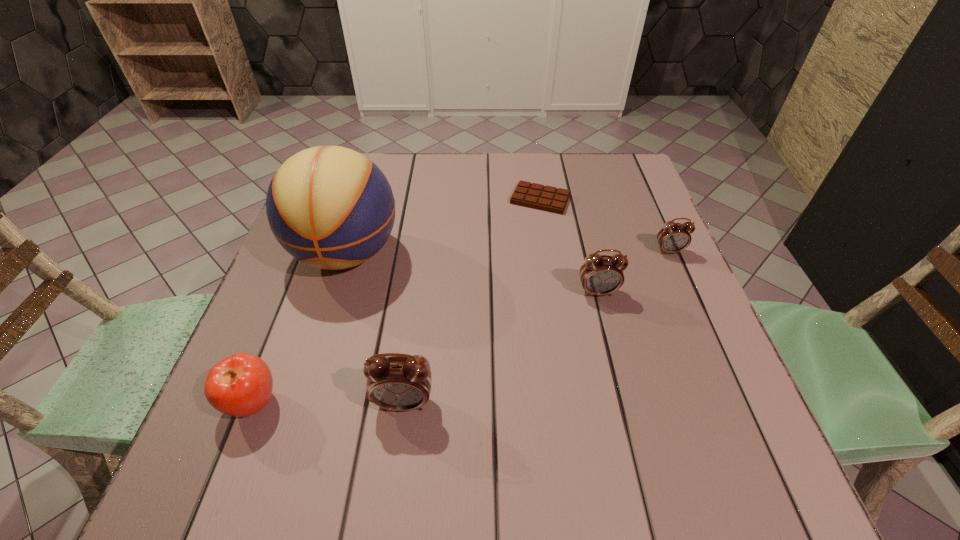
What are the coordinates of `empty location between the second tallest object and the basketball` in the screenshot? It's located at (375, 328).

Where is `unoccupied area between the apple and the rightmost alarm clock`? The height and width of the screenshot is (540, 960). unoccupied area between the apple and the rightmost alarm clock is located at coordinates tap(461, 327).

I want to click on vacant space in between the tallest object and the apple, so click(x=300, y=328).

The width and height of the screenshot is (960, 540). I want to click on free space that is in between the shortest object and the farthest alarm clock, so click(x=605, y=225).

Locate an element on the screen. The image size is (960, 540). free space between the shortest object and the tallest object is located at coordinates (444, 226).

Image resolution: width=960 pixels, height=540 pixels. Identify the location of vacant point located between the second tallest alarm clock and the basketball. (472, 273).

Locate an element on the screen. The image size is (960, 540). free space that is in between the farthest object and the farthest alarm clock is located at coordinates (605, 225).

I want to click on object that ranks as the third closest to the basketball, so click(x=537, y=196).

Find the location of a particular element. The height and width of the screenshot is (540, 960). object that ranks as the second closest to the candy bar is located at coordinates (600, 275).

Identify the location of alarm clock that is the closest one to the apple. This screenshot has height=540, width=960. (401, 383).